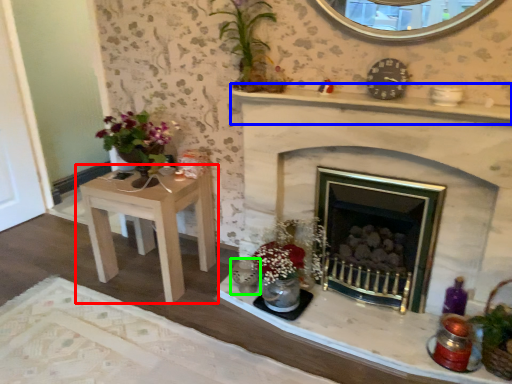
Question: Which is nearer to the table (highlighted by a red box)? mantle (highlighted by a blue box) or candle holder (highlighted by a green box).

Choices:
 (A) mantle
 (B) candle holder

Answer: (B)